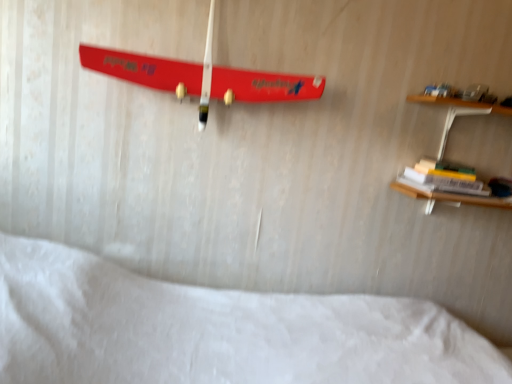
Question: Should I look upward or downward to see shiny red skateboard at upper center?

Choices:
 (A) up
 (B) down

Answer: (A)

Question: Is white soft bed at lower center further to the viewer compared to shiny red skateboard at upper center?

Choices:
 (A) no
 (B) yes

Answer: (A)

Question: Is white soft bed at lower center positioned with its back to shiny red skateboard at upper center?

Choices:
 (A) yes
 (B) no

Answer: (B)

Question: Considering the relative sizes of white soft bed at lower center and shiny red skateboard at upper center in the image provided, is white soft bed at lower center bigger than shiny red skateboard at upper center?

Choices:
 (A) no
 (B) yes

Answer: (B)

Question: Considering the relative sizes of white soft bed at lower center and shiny red skateboard at upper center in the image provided, is white soft bed at lower center taller than shiny red skateboard at upper center?

Choices:
 (A) no
 (B) yes

Answer: (B)

Question: Is shiny red skateboard at upper center located within white soft bed at lower center?

Choices:
 (A) yes
 (B) no

Answer: (B)

Question: From a real-world perspective, does white soft bed at lower center stand above shiny red skateboard at upper center?

Choices:
 (A) yes
 (B) no

Answer: (B)

Question: Can you confirm if shiny red skateboard at upper center is taller than hardcover book at right?

Choices:
 (A) yes
 (B) no

Answer: (A)

Question: Does shiny red skateboard at upper center appear on the right side of hardcover book at right?

Choices:
 (A) yes
 (B) no

Answer: (B)

Question: From a real-world perspective, does shiny red skateboard at upper center stand above hardcover book at right?

Choices:
 (A) yes
 (B) no

Answer: (A)

Question: Could hardcover book at right be considered to be inside shiny red skateboard at upper center?

Choices:
 (A) yes
 (B) no

Answer: (B)

Question: Is shiny red skateboard at upper center in contact with hardcover book at right?

Choices:
 (A) no
 (B) yes

Answer: (A)

Question: Is shiny red skateboard at upper center completely or partially outside of hardcover book at right?

Choices:
 (A) yes
 (B) no

Answer: (A)

Question: From a real-world perspective, is shiny red skateboard at upper center under white soft bed at lower center?

Choices:
 (A) no
 (B) yes

Answer: (A)